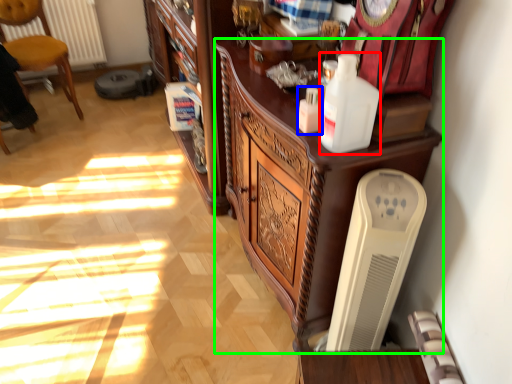
Question: Which object is the closest to the bottle (highlighted by a red box)? Choose among these: bottle (highlighted by a blue box) or cabinetry (highlighted by a green box).

Choices:
 (A) bottle
 (B) cabinetry

Answer: (A)